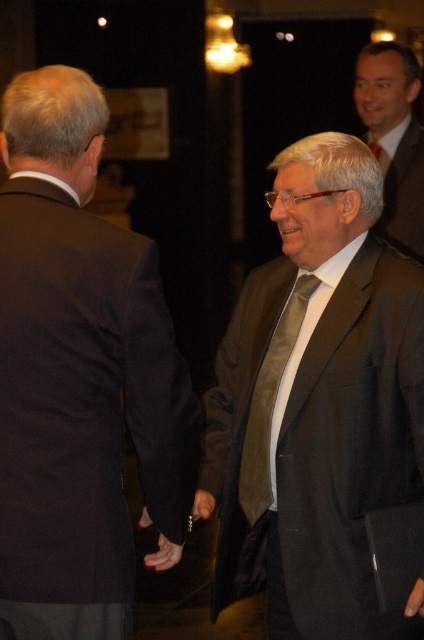
Does point (81, 356) lie in front of point (303, 298)?

Yes, it is in front of point (303, 298).

Does dark brown suit at left have a greater width compared to satin gold tie at center?

Yes.

Is point (55, 536) positioned before point (262, 502)?

Yes, point (55, 536) is closer to viewer.

Image resolution: width=424 pixels, height=640 pixels. Find the location of `dark brown suit at left`. dark brown suit at left is located at coordinates (78, 376).

Between point (343, 177) and point (360, 72), which one is positioned in front?

Positioned in front is point (343, 177).

Does matte brown suit at center have a smaller size compared to matte brown suit at upper right?

Incorrect, matte brown suit at center is not smaller in size than matte brown suit at upper right.

This screenshot has width=424, height=640. Identify the location of matte brown suit at center. (317, 403).

The width and height of the screenshot is (424, 640). Find the location of `matte brown suit at center`. matte brown suit at center is located at coordinates (317, 403).

Between matte brown suit at center and satin gold tie at center, which one appears on the right side from the viewer's perspective?

From the viewer's perspective, matte brown suit at center appears more on the right side.

Can you confirm if matte brown suit at center is bigger than satin gold tie at center?

Yes, matte brown suit at center is bigger than satin gold tie at center.

Does point (256, 477) lie in front of point (248, 448)?

Yes, point (256, 477) is closer to viewer.

Identify the location of matte brown suit at center. (317, 403).